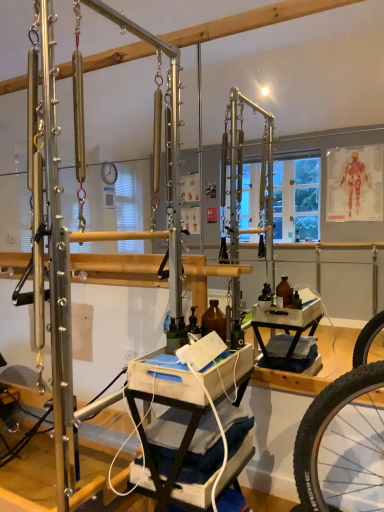
I want to click on white plastic tray at center, so click(x=191, y=428).

What do you see at coordinates (191, 428) in the screenshot? I see `white plastic tray at center` at bounding box center [191, 428].

The height and width of the screenshot is (512, 384). In order to click on white plastic tray at center in this screenshot , I will do `click(191, 428)`.